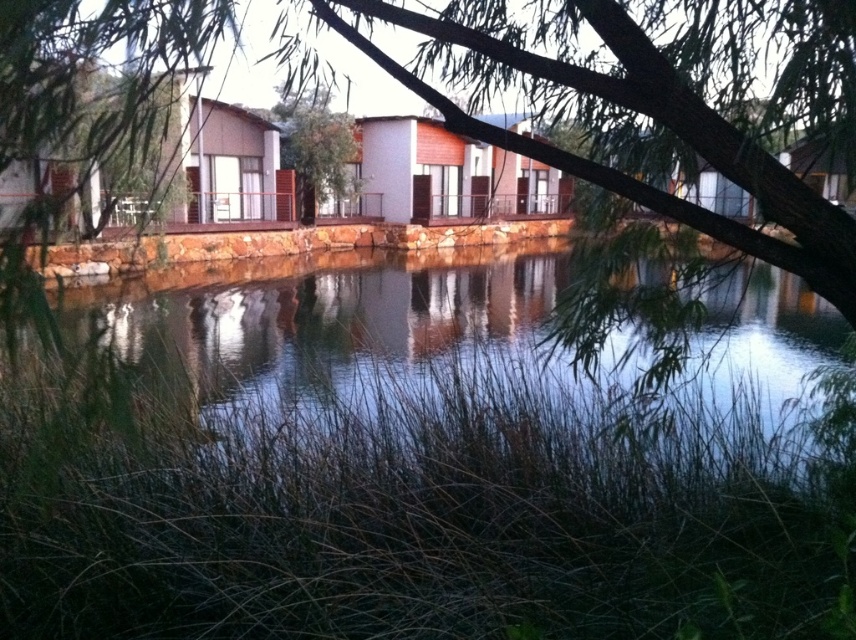
Describe the element at coordinates (317, 320) in the screenshot. The height and width of the screenshot is (640, 856). I see `green grassy river at center` at that location.

Is green grassy river at center positioned in front of green leafy tree at center?

Yes, green grassy river at center is in front of green leafy tree at center.

At what (x,y) coordinates should I click in order to perform the action: click on green grassy river at center. Please return your answer as a coordinate pair (x, y). This screenshot has width=856, height=640. Looking at the image, I should click on (317, 320).